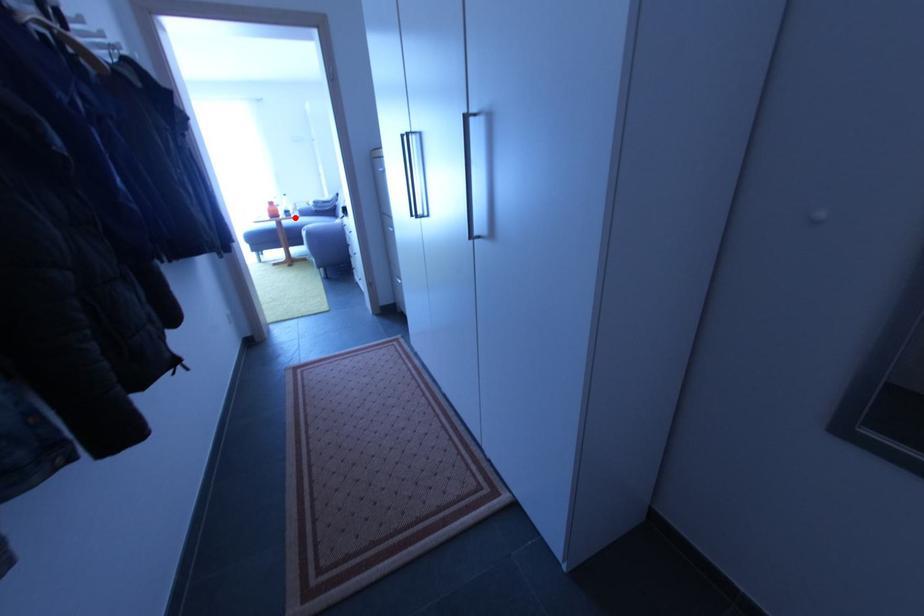
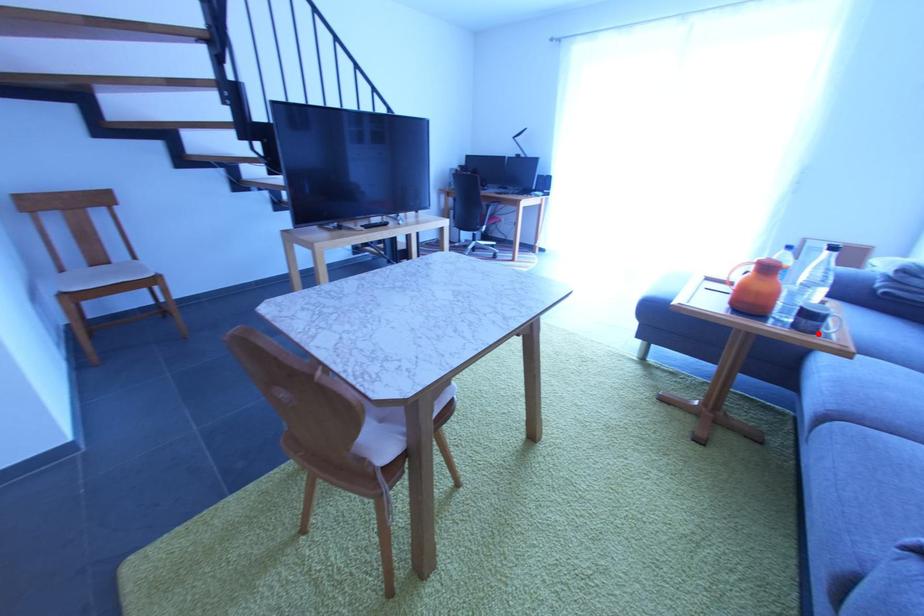
I am providing you with two images of the same scene from different viewpoints. A red point is marked on the first image and another point is marked on the second image. Is the marked point in image1 the same physical position as the marked point in image2?

Yes